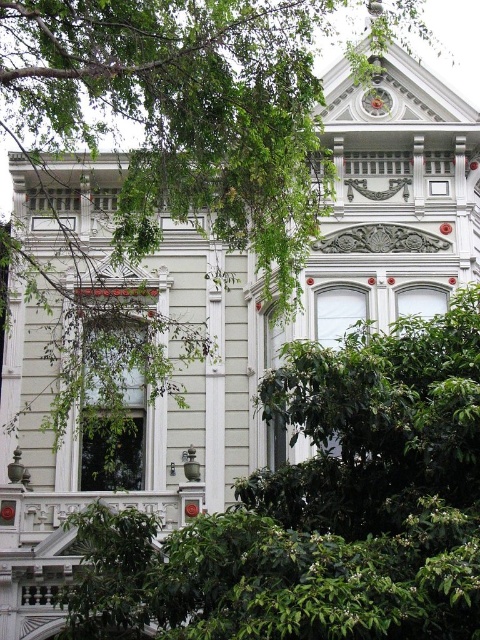
You are standing in a park and see the green leafy tree at center. If you want to take a photo of the tree from a distance of 100 feet, will you need to move closer or farther away?

The green leafy tree at center is currently 154.40 feet away from you. To achieve a distance of 100 feet, you need to move closer to the tree by approximately 54.40 feet.

You are standing in front of the Victorian building and notice the green leafy tree at center and the metallic clock at upper center. Which object is positioned higher on the building?

The metallic clock at upper center is positioned higher on the building than the green leafy tree at center.